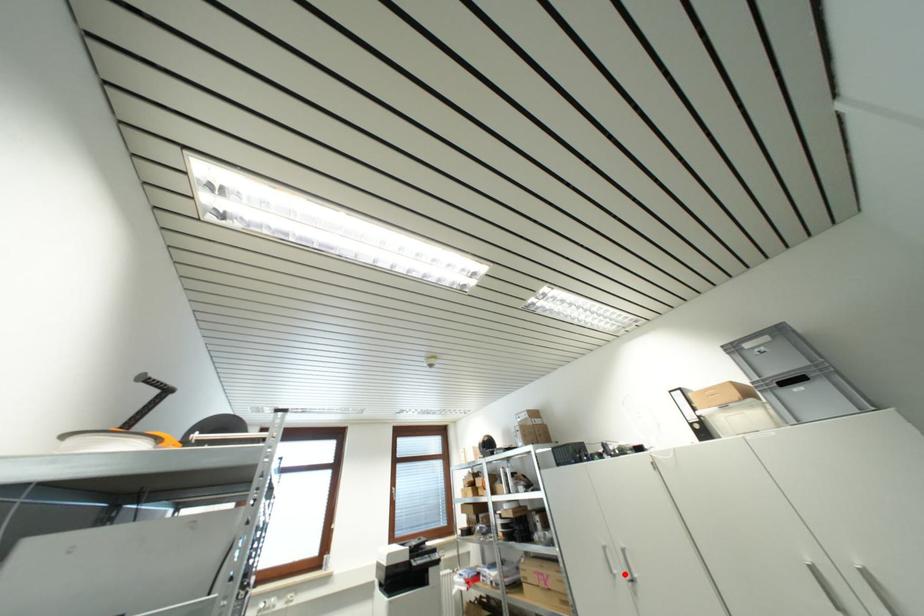
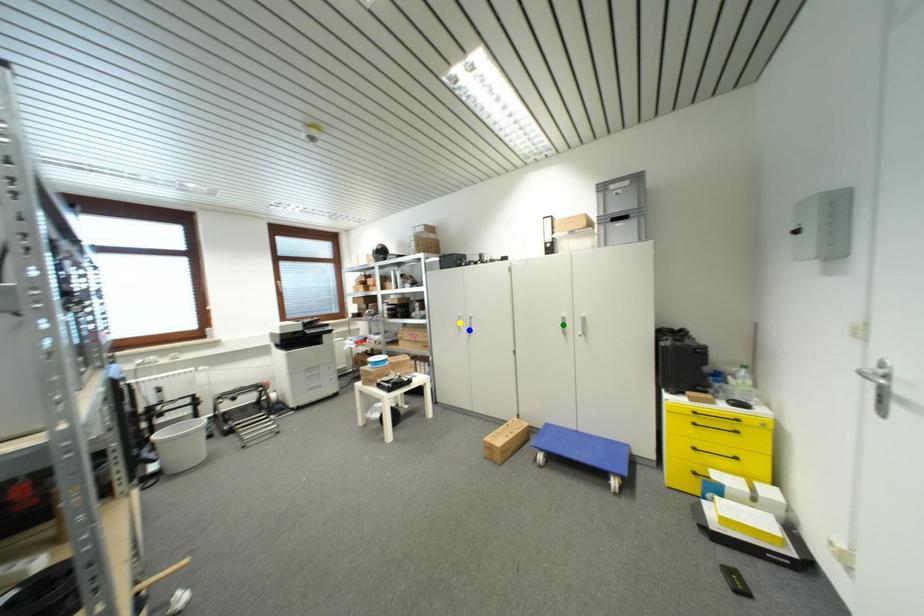
Question: I am providing you with two images of the same scene from different viewpoints. A red point is marked on the first image. You are given multiple points on the second image. Which point in image 2 represents the same 3d spot as the red point in image 1?

Choices:
 (A) green point
 (B) blue point
 (C) yellow point

Answer: (B)